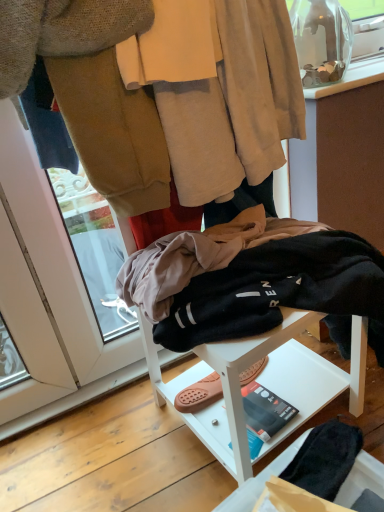
Describe the element at coordinates (261, 383) in the screenshot. I see `white matte stool at center` at that location.

Consider the image. What is the approximate height of white matte stool at center?

It is 14.72 inches.

Locate an element on the screen. white matte stool at center is located at coordinates (261, 383).

What do you see at coordinates (219, 90) in the screenshot? The height and width of the screenshot is (512, 384). I see `beige soft fabric robe at upper center` at bounding box center [219, 90].

At what (x,y) coordinates should I click in order to perform the action: click on beige soft fabric robe at upper center. Please return your answer as a coordinate pair (x, y). This screenshot has width=384, height=512. Looking at the image, I should click on (219, 90).

Where is `white matte stool at center`? white matte stool at center is located at coordinates (261, 383).

Which object is positioned more to the left, beige soft fabric robe at upper center or white matte stool at center?

beige soft fabric robe at upper center.

Which object is more forward, beige soft fabric robe at upper center or white matte stool at center?

white matte stool at center is in front.

Is point (210, 124) closer to camera compared to point (201, 411)?

Yes, it is.

From the image's perspective, which is below, beige soft fabric robe at upper center or white matte stool at center?

white matte stool at center, from the image's perspective.

From a real-world perspective, is beige soft fabric robe at upper center physically located above or below white matte stool at center?

beige soft fabric robe at upper center is situated higher than white matte stool at center in the real world.

Based on the photo, which object is thinner, beige soft fabric robe at upper center or white matte stool at center?

beige soft fabric robe at upper center.

Between beige soft fabric robe at upper center and white matte stool at center, which one has less height?

beige soft fabric robe at upper center is shorter.

Considering the sizes of objects beige soft fabric robe at upper center and white matte stool at center in the image provided, who is bigger, beige soft fabric robe at upper center or white matte stool at center?

With larger size is white matte stool at center.

Can we say beige soft fabric robe at upper center lies outside white matte stool at center?

Indeed, beige soft fabric robe at upper center is completely outside white matte stool at center.

Are beige soft fabric robe at upper center and white matte stool at center making contact?

No, beige soft fabric robe at upper center is not in contact with white matte stool at center.

Is beige soft fabric robe at upper center oriented away from white matte stool at center?

No, beige soft fabric robe at upper center is not facing away from white matte stool at center.

How much distance is there between beige soft fabric robe at upper center and white matte stool at center?

beige soft fabric robe at upper center is 46.18 centimeters from white matte stool at center.

Where is `furniture that is under the beige soft fabric robe at upper center (from a real-world perspective)`? Image resolution: width=384 pixels, height=512 pixels. furniture that is under the beige soft fabric robe at upper center (from a real-world perspective) is located at coordinates (261, 383).

Does white matte stool at center appear on the left side of beige soft fabric robe at upper center?

Incorrect, white matte stool at center is not on the left side of beige soft fabric robe at upper center.

Considering the positions of objects white matte stool at center and beige soft fabric robe at upper center in the image provided, who is in front, white matte stool at center or beige soft fabric robe at upper center?

Positioned in front is white matte stool at center.

Is point (281, 387) in front of point (149, 76)?

No, (281, 387) is further to viewer.

From the image's perspective, which is above, white matte stool at center or beige soft fabric robe at upper center?

beige soft fabric robe at upper center.

From a real-world perspective, relative to beige soft fabric robe at upper center, is white matte stool at center vertically above or below?

white matte stool at center is below beige soft fabric robe at upper center.

Which object is wider, white matte stool at center or beige soft fabric robe at upper center?

white matte stool at center.

Considering the sizes of objects white matte stool at center and beige soft fabric robe at upper center in the image provided, who is taller, white matte stool at center or beige soft fabric robe at upper center?

With more height is white matte stool at center.

Who is bigger, white matte stool at center or beige soft fabric robe at upper center?

white matte stool at center is bigger.

Is beige soft fabric robe at upper center located within white matte stool at center?

Actually, beige soft fabric robe at upper center is outside white matte stool at center.

Is white matte stool at center not close to beige soft fabric robe at upper center?

No, there isn't a large distance between white matte stool at center and beige soft fabric robe at upper center.

Is white matte stool at center turned away from beige soft fabric robe at upper center?

That's not correct — white matte stool at center is not looking away from beige soft fabric robe at upper center.

In order to click on robe on the left of white matte stool at center in this screenshot , I will do `click(219, 90)`.

Identify the location of robe that is above the white matte stool at center (from a real-world perspective). The width and height of the screenshot is (384, 512). (219, 90).

In the image, there is a beige soft fabric robe at upper center. At what (x,y) coordinates should I click in order to perform the action: click on furniture below it (from the image's perspective). Please return your answer as a coordinate pair (x, y). Image resolution: width=384 pixels, height=512 pixels. Looking at the image, I should click on (261, 383).